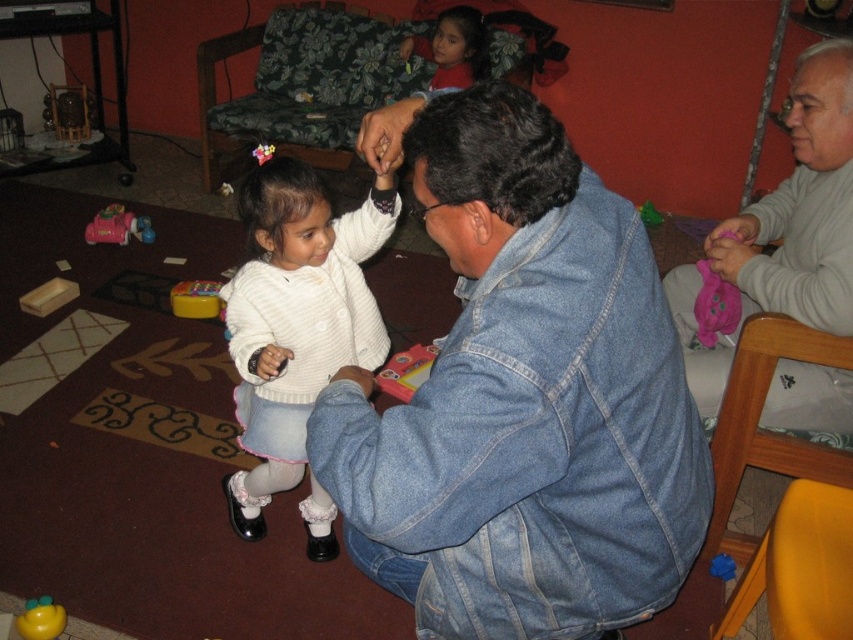
Is point (840, 428) farther from camera compared to point (38, 618)?

Yes, it is behind point (38, 618).

Between point (822, 116) and point (15, 621), which one is positioned behind?

The point (15, 621) is behind.

Does point (837, 198) lie in front of point (64, 612)?

Yes.

The image size is (853, 640). Identify the location of gray sweater at upper right. point(801,208).

Where is `gray sweater at upper right`? The height and width of the screenshot is (640, 853). gray sweater at upper right is located at coordinates (801, 208).

From the picture: Is gray sweater at upper right thinner than pink plush toy at lower right?

No.

Is point (822, 205) positioned in front of point (720, 330)?

Yes, it is in front of point (720, 330).

Identify the location of gray sweater at upper right. Image resolution: width=853 pixels, height=640 pixels. (801, 208).

Does matte red sweater at upper center appear over pink plush toy at lower right?

Correct, matte red sweater at upper center is located above pink plush toy at lower right.

Is point (451, 10) farther from viewer compared to point (722, 278)?

Yes, it is behind point (722, 278).

Where is `matte red sweater at upper center`? matte red sweater at upper center is located at coordinates (457, 49).